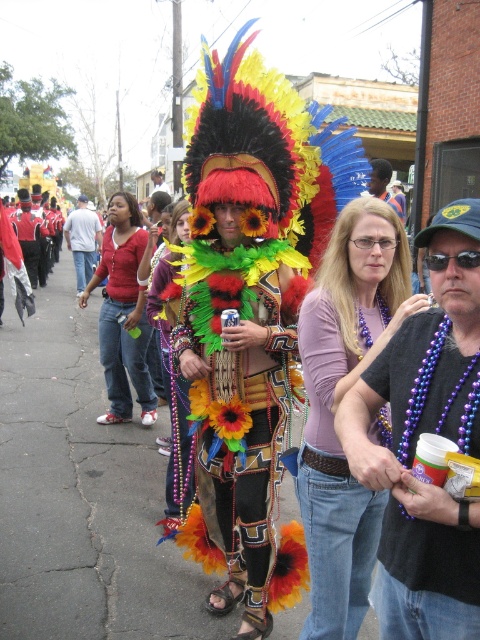
You are trying to determine which object is larger between the matte red shirt at center and the brushed metal can at center. Based on the scene description, which one is bigger?

The brushed metal can at center is larger than the matte red shirt at center.

From the picture: You are a photographer trying to capture the central figure in the parade. You notice two purple beaded necklaces in the frame. Which one is closer to the camera, the purple beaded necklace at center or the purple beaded necklace at lower right?

The purple beaded necklace at center is closer to the camera because it is positioned over the purple beaded necklace at lower right.

You are a photographer at the festival trying to capture the central figure. Since you want to focus on the costume details, which object should you zoom in on more closely between the matte black shirt at center and the matte black hat at center?

The matte black shirt at center is larger in size than the matte black hat at center, so you should zoom in more on the matte black shirt at center to capture its details clearly.